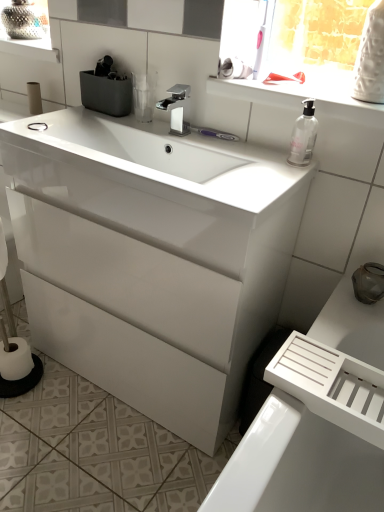
Locate an element on the screen. The height and width of the screenshot is (512, 384). vacant area situated to the left side of polished chrome faucet at center is located at coordinates (121, 127).